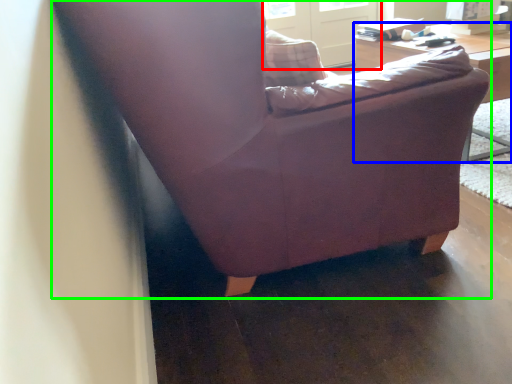
Question: Which object is positioned closest to screen door (highlighted by a red box)? Select from table (highlighted by a blue box) and chair (highlighted by a green box).

Choices:
 (A) table
 (B) chair

Answer: (A)